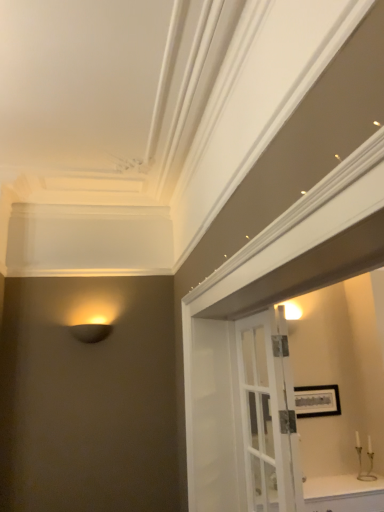
Question: Is metallic gold candle holder at lower right oriented towards white glass door at center?

Choices:
 (A) no
 (B) yes

Answer: (A)

Question: Would you say metallic gold candle holder at lower right is a long distance from white glass door at center?

Choices:
 (A) yes
 (B) no

Answer: (A)

Question: Considering the relative positions of metallic gold candle holder at lower right and white glass door at center in the image provided, is metallic gold candle holder at lower right to the left of white glass door at center from the viewer's perspective?

Choices:
 (A) no
 (B) yes

Answer: (A)

Question: Can you confirm if metallic gold candle holder at lower right is wider than white glass door at center?

Choices:
 (A) yes
 (B) no

Answer: (B)

Question: Is metallic gold candle holder at lower right taller than white glass door at center?

Choices:
 (A) yes
 (B) no

Answer: (B)

Question: Is white glass door at center bigger or smaller than metallic gold candle holder at lower right?

Choices:
 (A) small
 (B) big

Answer: (B)

Question: From their relative heights in the image, would you say white glass door at center is taller or shorter than metallic gold candle holder at lower right?

Choices:
 (A) short
 (B) tall

Answer: (B)

Question: Looking at their shapes, would you say white glass door at center is wider or thinner than metallic gold candle holder at lower right?

Choices:
 (A) thin
 (B) wide

Answer: (B)

Question: From a real-world perspective, is white glass door at center positioned above or below metallic gold candle holder at lower right?

Choices:
 (A) below
 (B) above

Answer: (B)

Question: Considering the positions of white glossy cabinet at lower right and matte black lamp at left in the image, is white glossy cabinet at lower right bigger or smaller than matte black lamp at left?

Choices:
 (A) small
 (B) big

Answer: (B)

Question: Is white glossy cabinet at lower right inside the boundaries of matte black lamp at left, or outside?

Choices:
 (A) inside
 (B) outside

Answer: (B)

Question: In the image, is white glossy cabinet at lower right positioned in front of or behind matte black lamp at left?

Choices:
 (A) behind
 (B) front

Answer: (B)

Question: From a real-world perspective, is white glossy cabinet at lower right positioned above or below matte black lamp at left?

Choices:
 (A) above
 (B) below

Answer: (B)

Question: From the image's perspective, is white glossy cabinet at lower right located above or below white glass door at center?

Choices:
 (A) above
 (B) below

Answer: (B)

Question: Based on their positions, is white glossy cabinet at lower right located to the left or right of white glass door at center?

Choices:
 (A) right
 (B) left

Answer: (A)